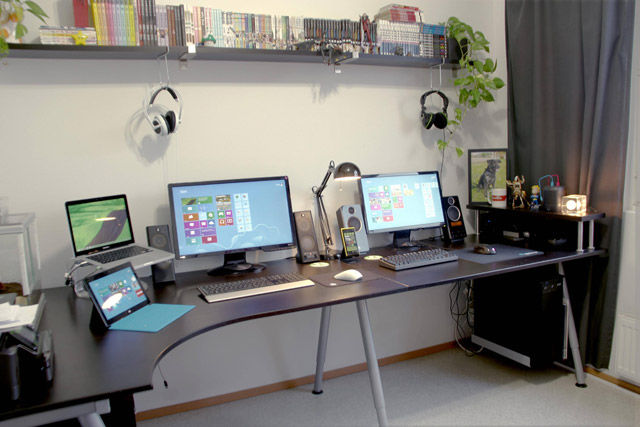
Where is `table`? table is located at coordinates (196, 327).